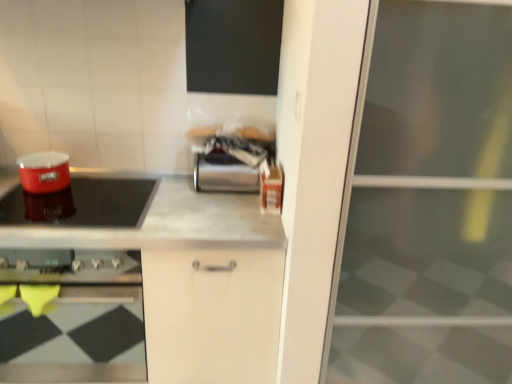
Question: From the image's perspective, would you say transparent glass screen door at right is shown under metallic gray countertop at center?

Choices:
 (A) yes
 (B) no

Answer: (B)

Question: From the image's perspective, is transparent glass screen door at right over metallic gray countertop at center?

Choices:
 (A) yes
 (B) no

Answer: (A)

Question: Is transparent glass screen door at right far from metallic gray countertop at center?

Choices:
 (A) yes
 (B) no

Answer: (B)

Question: Is transparent glass screen door at right wider than metallic gray countertop at center?

Choices:
 (A) no
 (B) yes

Answer: (B)

Question: Is transparent glass screen door at right positioned beyond the bounds of metallic gray countertop at center?

Choices:
 (A) no
 (B) yes

Answer: (B)

Question: Considering the positions of satin silver canister at center, which ranks as the 2th appliance in left-to-right order, and transparent glass screen door at right in the image, is satin silver canister at center, which ranks as the 2th appliance in left-to-right order, taller or shorter than transparent glass screen door at right?

Choices:
 (A) tall
 (B) short

Answer: (B)

Question: From a real-world perspective, is satin silver canister at center, which is the 1th appliance from right to left, positioned above or below transparent glass screen door at right?

Choices:
 (A) above
 (B) below

Answer: (A)

Question: Which is correct: satin silver canister at center, which ranks as the 2th appliance in left-to-right order, is inside transparent glass screen door at right, or outside of it?

Choices:
 (A) outside
 (B) inside

Answer: (A)

Question: In the image, is satin silver canister at center, which ranks as the 2th appliance in left-to-right order, positioned in front of or behind transparent glass screen door at right?

Choices:
 (A) front
 (B) behind

Answer: (B)

Question: From the image's perspective, relative to satin silver canister at center, which ranks as the 2th appliance in left-to-right order, is matte red pot at left, which ranks as the first appliance in left-to-right order, above or below?

Choices:
 (A) above
 (B) below

Answer: (B)

Question: Considering the positions of matte red pot at left, which is the second appliance from right to left, and satin silver canister at center, which is the 1th appliance from right to left, in the image, is matte red pot at left, which is the second appliance from right to left, wider or thinner than satin silver canister at center, which is the 1th appliance from right to left,?

Choices:
 (A) thin
 (B) wide

Answer: (B)

Question: Is point (38, 160) closer or farther from the camera than point (197, 155)?

Choices:
 (A) farther
 (B) closer

Answer: (B)

Question: Based on their positions, is matte red pot at left, which ranks as the first appliance in left-to-right order, located to the left or right of satin silver canister at center, which is the 1th appliance from right to left?

Choices:
 (A) left
 (B) right

Answer: (A)

Question: From a real-world perspective, relative to matte black cooktop at left, is shiny red pot at left vertically above or below?

Choices:
 (A) above
 (B) below

Answer: (A)

Question: Is point (8, 208) positioned closer to the camera than point (138, 261)?

Choices:
 (A) farther
 (B) closer

Answer: (A)